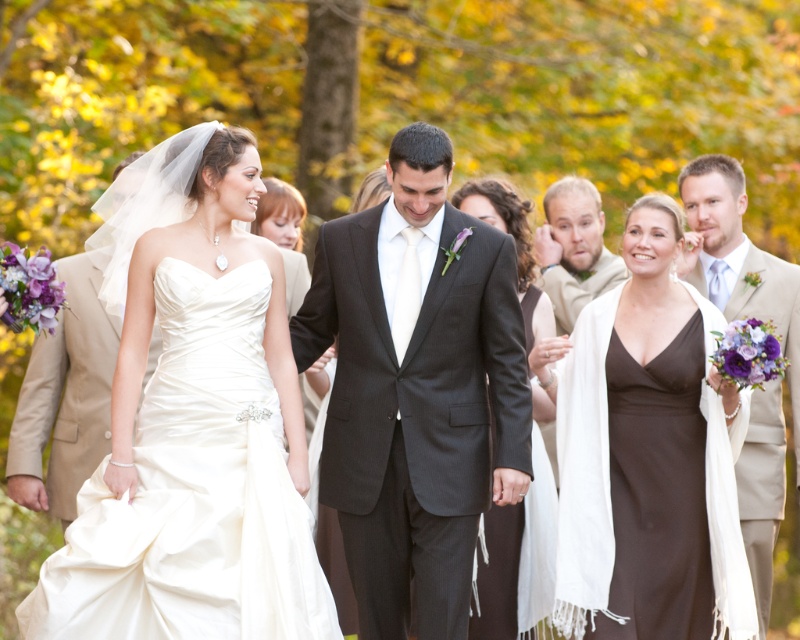
You are a photographer trying to capture the best shot of the wedding couple. You notice two points marked in the scene. The first point is at coordinate point(416, 305) and the second is at point(596, 218). Which point is closer to the camera?

Point(416, 305) is in front of point(596, 218), so it is closer to the camera.

You are a photographer at a wedding and need to capture a group photo. You have two outfits to consider for the couple. The tan fabric suit at left and the matte black dress at center. Based on their sizes, which outfit would allow more space between the couple and the background for a better depth of field?

The tan fabric suit at left has a smaller size compared to matte black dress at center, so using the tan fabric suit at left would allow more space between the couple and the background for a better depth of field.